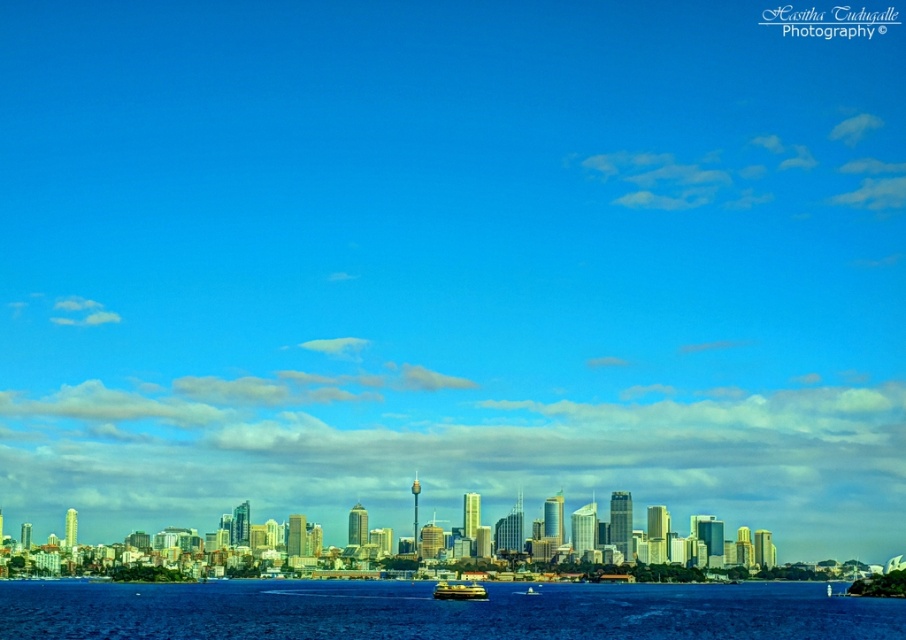
Question: Is blue liquid water at lower center thinner than yellow matte boat at center?

Choices:
 (A) yes
 (B) no

Answer: (B)

Question: Which object is farther from the camera taking this photo?

Choices:
 (A) blue liquid water at lower center
 (B) yellow matte boat at center

Answer: (B)

Question: Among these points, which one is nearest to the camera?

Choices:
 (A) (451, 627)
 (B) (473, 582)

Answer: (A)

Question: Observing the image, what is the correct spatial positioning of blue liquid water at lower center in reference to yellow matte boat at center?

Choices:
 (A) left
 (B) right

Answer: (A)

Question: Does blue liquid water at lower center appear under yellow matte boat at center?

Choices:
 (A) yes
 (B) no

Answer: (A)